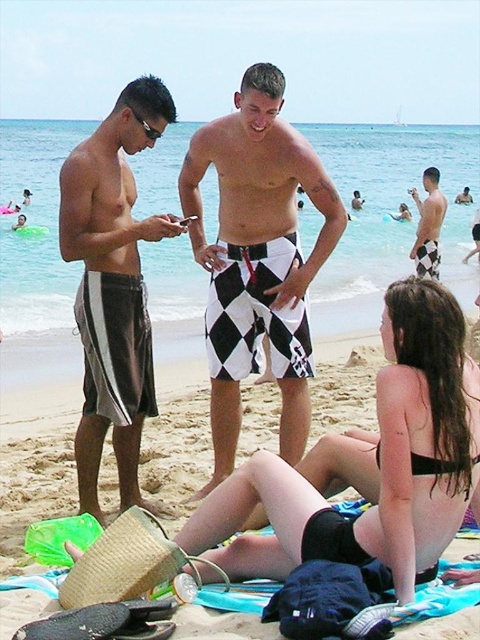
Consider the image. Is black checkered shorts at center wider than brown striped shorts at left?

Incorrect, black checkered shorts at center's width does not surpass brown striped shorts at left's.

Can you confirm if black checkered shorts at center is shorter than brown striped shorts at left?

In fact, black checkered shorts at center may be taller than brown striped shorts at left.

Find the location of a particular element. This screenshot has height=640, width=480. black checkered shorts at center is located at coordinates (257, 257).

Can you confirm if black matte bikini bottom at lower center is smaller than black checkered shorts at center?

Actually, black matte bikini bottom at lower center might be larger than black checkered shorts at center.

Where is `black matte bikini bottom at lower center`? black matte bikini bottom at lower center is located at coordinates pyautogui.click(x=368, y=464).

Can you confirm if black matte bikini bottom at lower center is shorter than brown striped shorts at left?

In fact, black matte bikini bottom at lower center may be taller than brown striped shorts at left.

Is point (199, 528) positioned before point (86, 300)?

Yes, it is in front of point (86, 300).

Where is `black matte bikini bottom at lower center`? black matte bikini bottom at lower center is located at coordinates (368, 464).